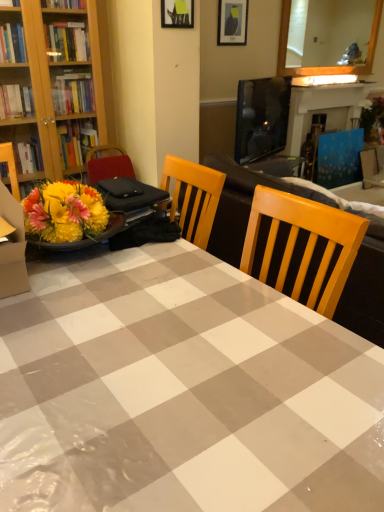
Question: Visually, is blue painted wood fireplace at upper right positioned to the left or to the right of wooden frame mirror at upper right?

Choices:
 (A) left
 (B) right

Answer: (B)

Question: Do you think blue painted wood fireplace at upper right is within wooden frame mirror at upper right, or outside of it?

Choices:
 (A) inside
 (B) outside

Answer: (B)

Question: Based on their relative distances, which object is farther from the blue fabric armchair at right?

Choices:
 (A) gray checkered tablecloth at center
 (B) blue painted wood fireplace at upper right
 (C) matte black picture frame at upper center, which is counted as the 1th picture frame, starting from the top
 (D) metallic silver picture frame at upper center, the second picture frame from the back
 (E) wooden frame mirror at upper right

Answer: (A)

Question: Estimate the real-world distances between objects in this image. Which object is farther from the gray checkered tablecloth at center?

Choices:
 (A) metallic silver picture frame at upper center, the second picture frame from the back
 (B) wooden frame mirror at upper right
 (C) blue fabric armchair at right
 (D) blue painted wood fireplace at upper right
 (E) matte black picture frame at upper center, positioned as the first picture frame in back-to-front order

Answer: (B)